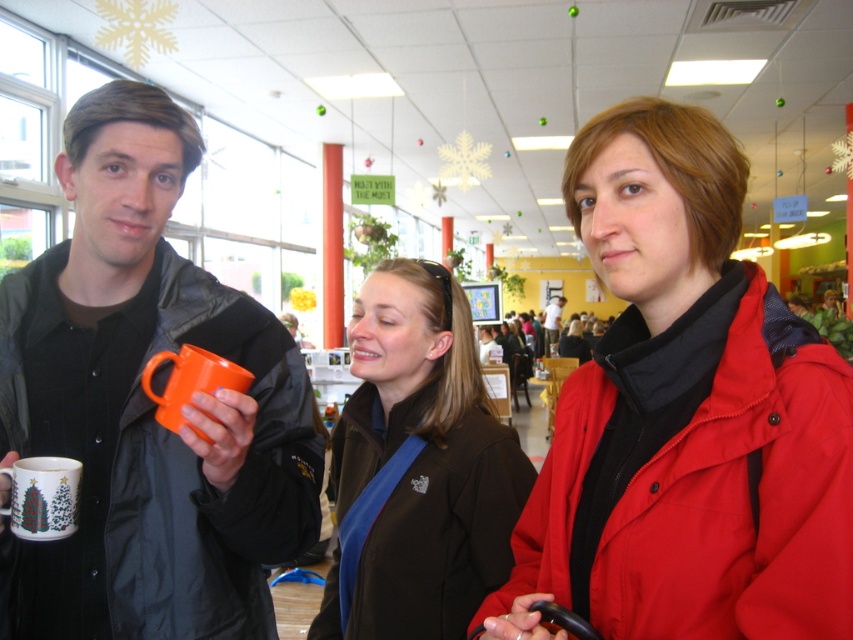
Question: Which object is positioned closest to the porcelain christmas tree mug at center?

Choices:
 (A) matte red jacket at center
 (B) brown softshell jacket at center
 (C) matte orange mug at left

Answer: (C)

Question: Is matte orange mug at left further to camera compared to porcelain christmas tree mug at center?

Choices:
 (A) yes
 (B) no

Answer: (B)

Question: Which object appears farthest from the camera in this image?

Choices:
 (A) orange matte mug at center
 (B) matte red jacket at center

Answer: (A)

Question: Can you confirm if matte orange mug at left is wider than orange matte mug at center?

Choices:
 (A) no
 (B) yes

Answer: (B)

Question: Which point is farther to the camera?

Choices:
 (A) matte orange mug at center
 (B) matte red jacket at center
 (C) matte orange mug at left

Answer: (A)

Question: Is matte orange mug at left wider than matte orange mug at center?

Choices:
 (A) no
 (B) yes

Answer: (A)